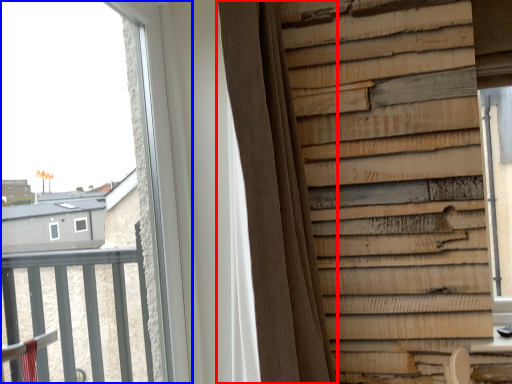
Question: Among these objects, which one is farthest to the camera, curtain (highlighted by a red box) or window (highlighted by a blue box)?

Choices:
 (A) curtain
 (B) window

Answer: (A)